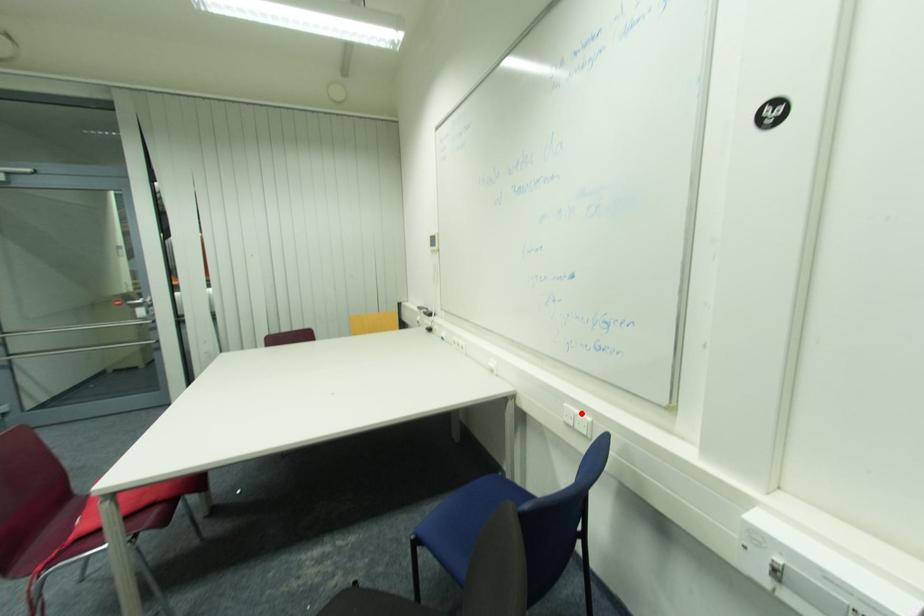
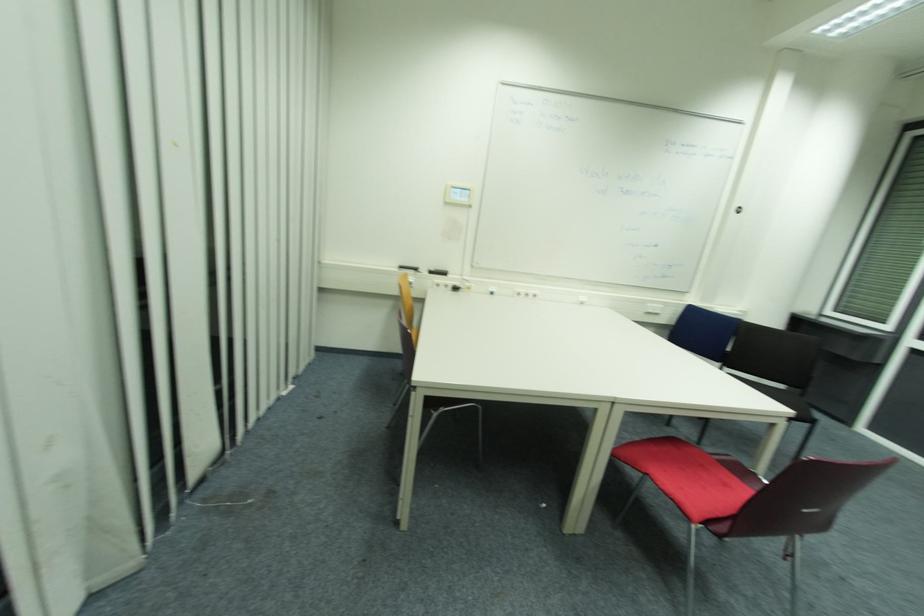
Where in the second image is the point corresponding to the highlighted location from the first image?

(658, 306)